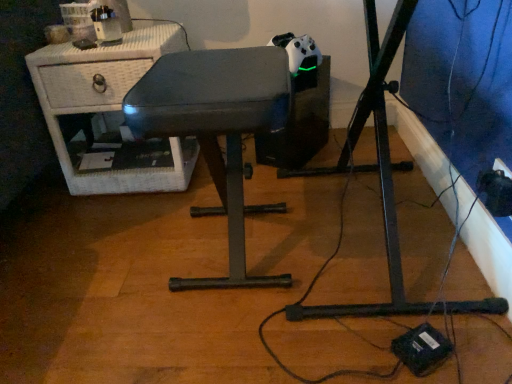
Where is `vacant space underneath metallic gray stool at center, which is counted as the first furniture, starting from the front (from a real-world perspective)`? vacant space underneath metallic gray stool at center, which is counted as the first furniture, starting from the front (from a real-world perspective) is located at coordinates (223, 253).